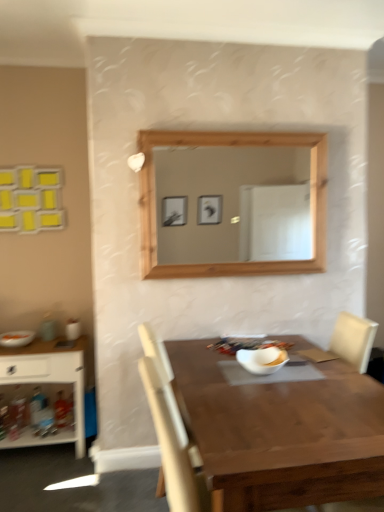
Locate an element on the screen. The image size is (384, 512). vacant area to the right of white glossy bowl at center is located at coordinates (310, 374).